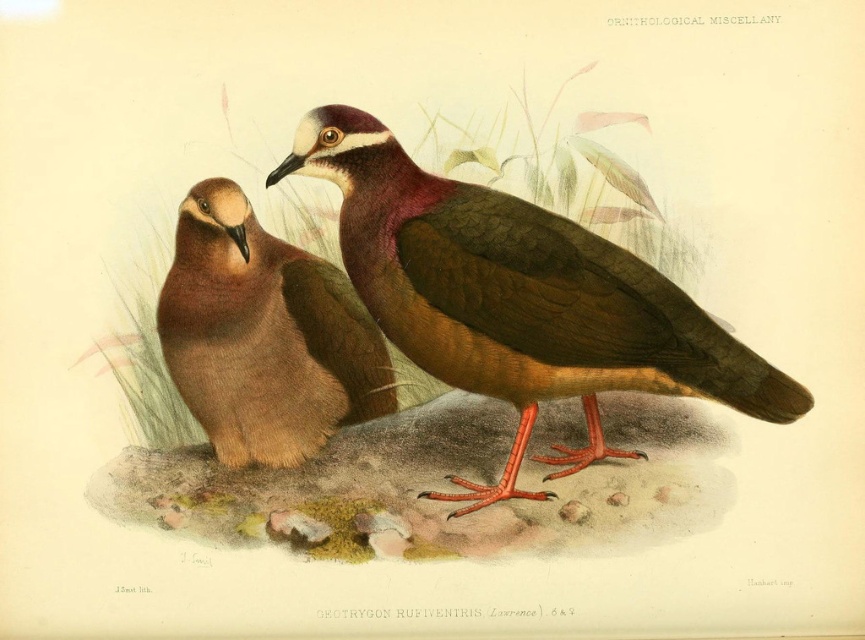
Between brown matte bird at center and brown matte pigeon at left, which one appears on the right side from the viewer's perspective?

From the viewer's perspective, brown matte bird at center appears more on the right side.

Is brown matte bird at center taller than brown matte pigeon at left?

Yes.

Where is `brown matte bird at center`? brown matte bird at center is located at coordinates (517, 298).